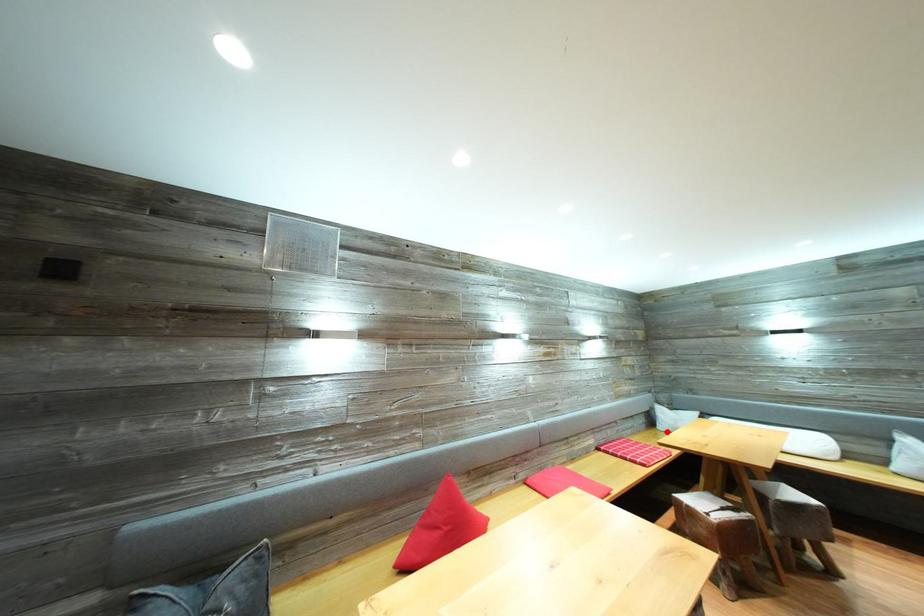
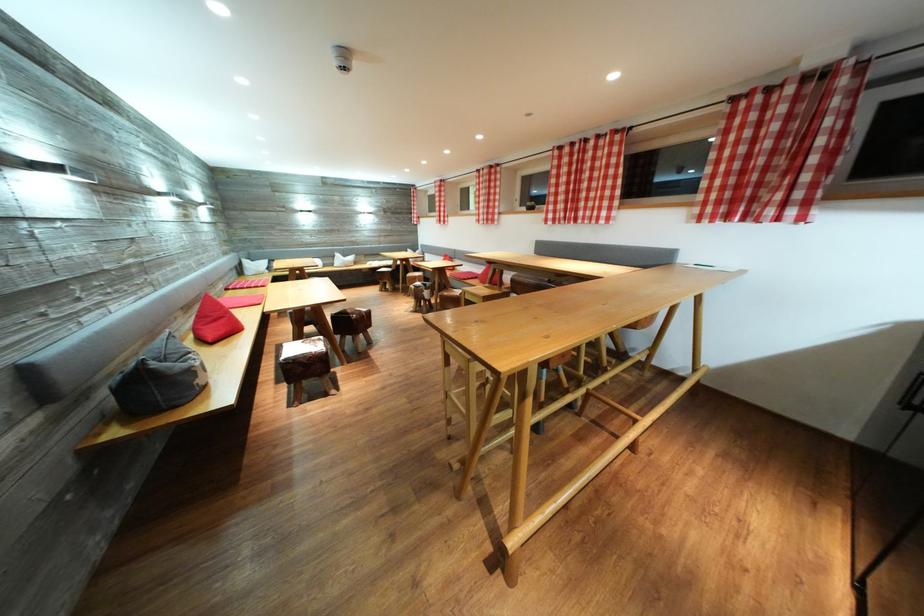
Where in the second image is the point corresponding to the highlighted location from the first image?

(254, 278)